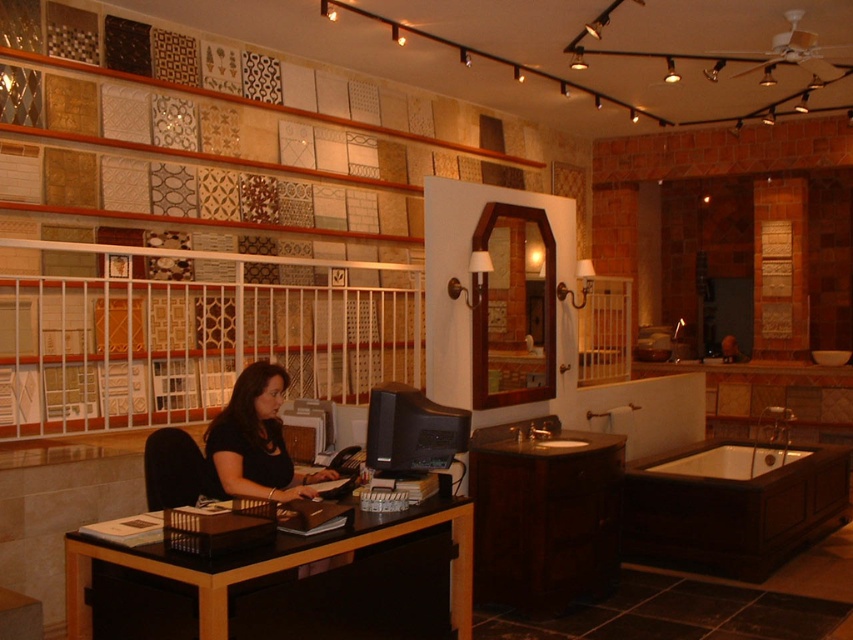
You are standing at the entrance of the showroom and want to approach the dark wood cabinet at lower center. Based on its 2D coordinates, in which direction should you move relative to your starting position?

The dark wood cabinet at lower center is located at coordinates point (543, 513). Since the coordinate system typically places the origin at the bottom left corner, moving towards higher x and y values would mean moving to the right and upwards respectively. However, since the cabinet is at lower center, it suggests it is positioned towards the bottom half of the image and centered horizontally. Therefore, you should move forward and slightly to the right from the entrance to reach it.

You are a customer in a bathroom fixture showroom and want to compare two bathtubs. You see a wooden bathtub at lower right and a white glossy bathtub at lower right. Which one is located more to the right side?

The wooden bathtub at lower right is positioned on the right side of white glossy bathtub at lower right, so the wooden bathtub at lower right is more to the right.

You are designing a bathroom and need to choose between the wooden bathtub at lower right and the white glossy bathtub at lower right. Based on their heights, which one would you recommend if you want a bathtub that takes up less vertical space?

The white glossy bathtub at lower right is shorter than the wooden bathtub at lower right, so it would take up less vertical space and is recommended for that purpose.